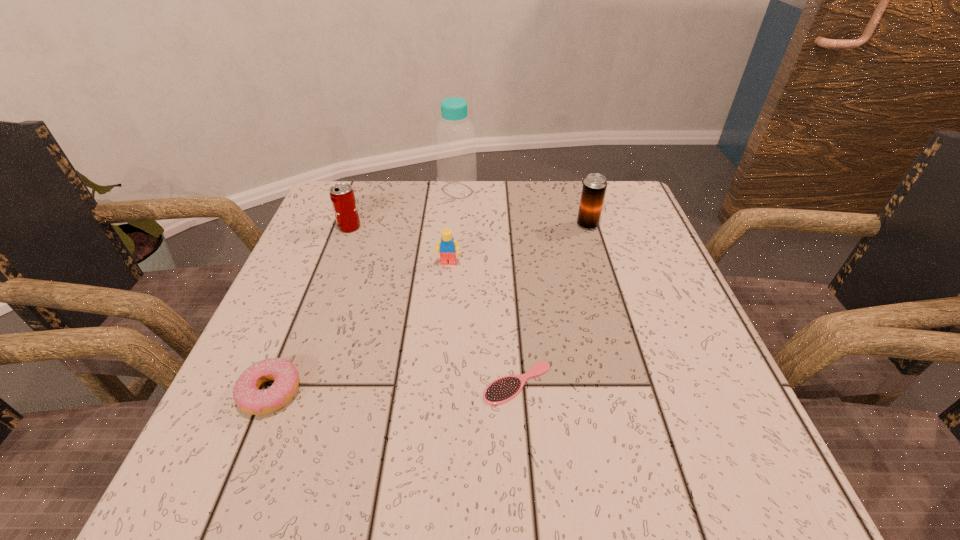
What are the coordinates of `blank region between the right beer can and the farthest object` in the screenshot? It's located at (522, 207).

Find the location of a particular element. This screenshot has height=540, width=960. free point between the tallest object and the shortest object is located at coordinates (488, 287).

The image size is (960, 540). Find the location of `free space between the tallest object and the fourth farthest object`. free space between the tallest object and the fourth farthest object is located at coordinates (453, 227).

Locate an element on the screen. The height and width of the screenshot is (540, 960). free space between the doughnut and the right beer can is located at coordinates (429, 308).

Image resolution: width=960 pixels, height=540 pixels. Find the location of `vacant region between the shortest object and the second shortest object`. vacant region between the shortest object and the second shortest object is located at coordinates (394, 388).

The height and width of the screenshot is (540, 960). In order to click on unoccupied position between the third nearest object and the second shortest object in this screenshot , I will do `click(359, 328)`.

Locate an element on the screen. vacant space in between the fourth shortest object and the doughnut is located at coordinates (310, 310).

What are the coordinates of `free area in between the third tallest object and the farthest object` in the screenshot? It's located at click(x=403, y=209).

Where is `unoccupied position between the Lego and the doughnut`? unoccupied position between the Lego and the doughnut is located at coordinates (359, 328).

Where is `free space between the rightmost object and the shorter beer can`? free space between the rightmost object and the shorter beer can is located at coordinates (468, 226).